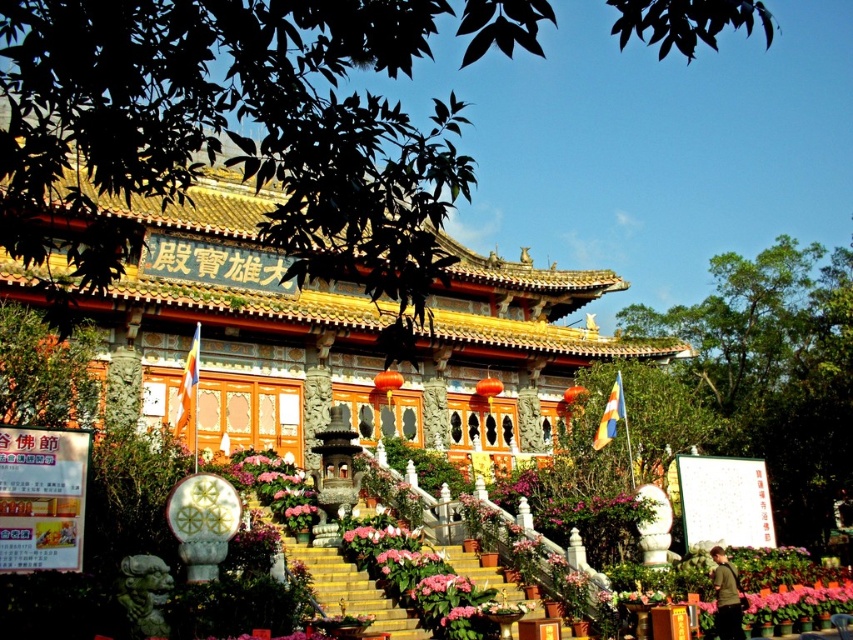
Question: Which of the following is the closest to the observer?

Choices:
 (A) (466, 595)
 (B) (544, 420)

Answer: (A)

Question: Does golden ornate palace at center appear on the right side of pink matte flower at center?

Choices:
 (A) no
 (B) yes

Answer: (B)

Question: Does golden ornate palace at center appear on the right side of pink matte flower at center?

Choices:
 (A) yes
 (B) no

Answer: (A)

Question: Which of the following is the farthest from the observer?

Choices:
 (A) pink matte flower at center
 (B) golden ornate palace at center

Answer: (A)

Question: Among these points, which one is nearest to the camera?

Choices:
 (A) (453, 600)
 (B) (544, 272)

Answer: (A)

Question: Is golden ornate palace at center closer to the viewer compared to pink matte flower at center?

Choices:
 (A) yes
 (B) no

Answer: (A)